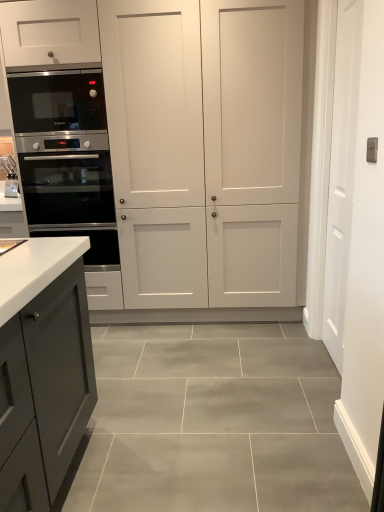
Question: Is black stainless steel microwave at left in front of or behind white glossy sink at left in the image?

Choices:
 (A) front
 (B) behind

Answer: (A)

Question: Considering the positions of point (99, 121) and point (6, 161), is point (99, 121) closer or farther from the camera than point (6, 161)?

Choices:
 (A) closer
 (B) farther

Answer: (A)

Question: Estimate the real-world distances between objects in this image. Which object is closer to the stainless steel oven at left?

Choices:
 (A) white matte cabinet at center
 (B) black stainless steel microwave at left
 (C) white glossy sink at left
 (D) white smooth door at right

Answer: (B)

Question: Which object is the farthest from the black stainless steel microwave at left?

Choices:
 (A) stainless steel oven at left
 (B) white glossy sink at left
 (C) white smooth door at right
 (D) white matte cabinet at center

Answer: (C)